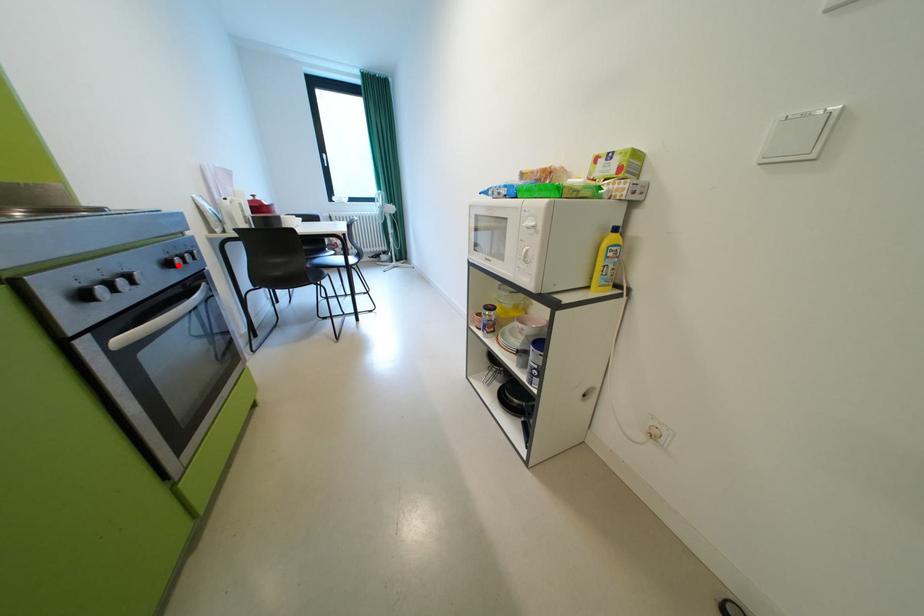
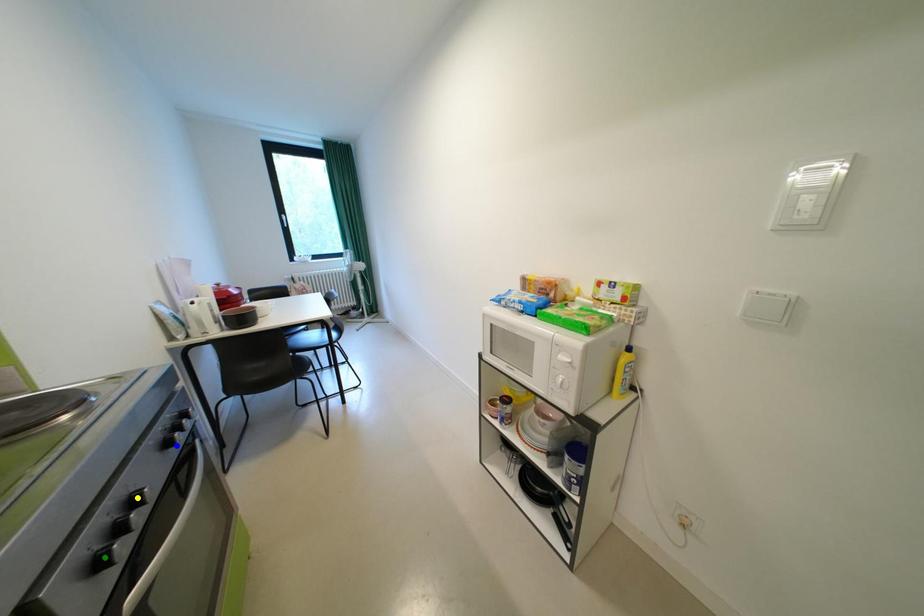
Question: I am providing you with two images of the same scene from different viewpoints. A red point is marked on the first image. You are given multiple points on the second image. Can you choose the point in image 2 that corresponds to the point in image 1?

Choices:
 (A) green point
 (B) blue point
 (C) yellow point

Answer: (B)